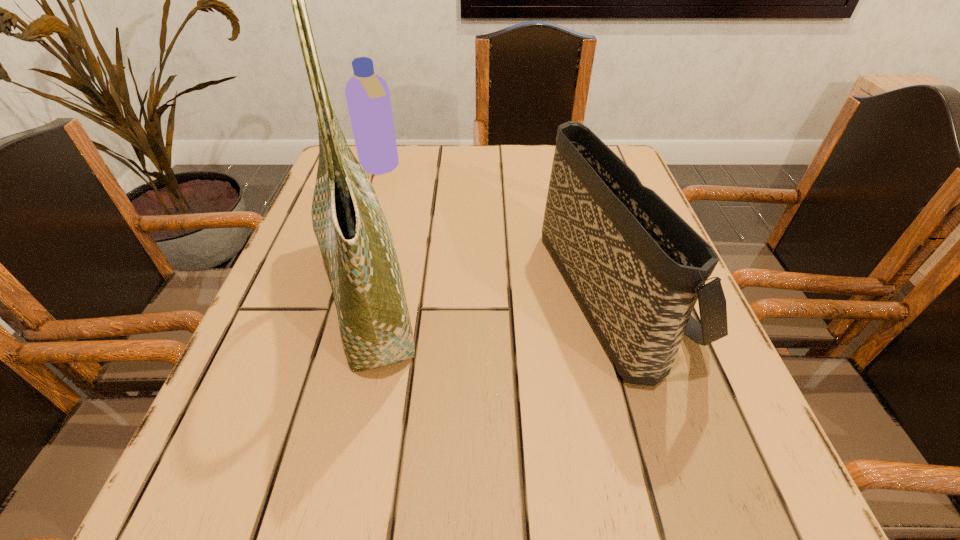
Locate an element on the screen. The image size is (960, 540). object present at the far left corner is located at coordinates (367, 94).

Image resolution: width=960 pixels, height=540 pixels. I want to click on vacant space at the far edge of the desktop, so click(534, 179).

Locate an element on the screen. Image resolution: width=960 pixels, height=540 pixels. vacant space at the near edge of the desktop is located at coordinates (383, 521).

Locate an element on the screen. This screenshot has width=960, height=540. vacant region at the left edge of the desktop is located at coordinates (248, 407).

Locate an element on the screen. This screenshot has width=960, height=540. free space at the right edge of the desktop is located at coordinates (690, 384).

Image resolution: width=960 pixels, height=540 pixels. In the image, there is a desktop. Find the location of `free space at the near left corner`. free space at the near left corner is located at coordinates (217, 523).

Identify the location of vacant space at the near right corner of the desktop. The image size is (960, 540). (746, 461).

This screenshot has width=960, height=540. What are the coordinates of `free space between the shampoo and the rightmost object` in the screenshot? It's located at (496, 228).

Identify the location of empty space between the rightmost object and the farthest object. (496, 228).

Where is `free point between the farthest object and the rightmost object`? Image resolution: width=960 pixels, height=540 pixels. free point between the farthest object and the rightmost object is located at coordinates (496, 228).